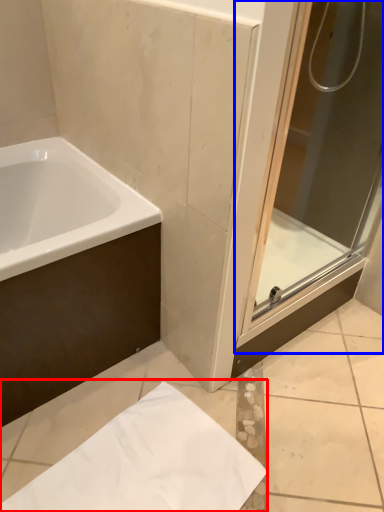
Question: Which point is further to the camera, paper (highlighted by a red box) or screen door (highlighted by a blue box)?

Choices:
 (A) paper
 (B) screen door

Answer: (A)